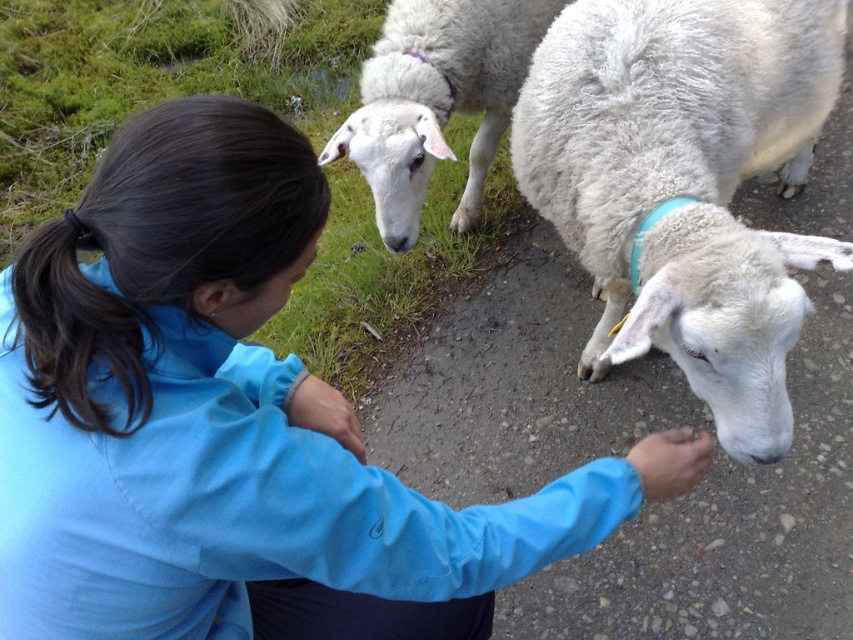
Is blue fabric jacket at center to the left of white woolen sheep at upper center from the viewer's perspective?

Correct, you'll find blue fabric jacket at center to the left of white woolen sheep at upper center.

Does point (13, 515) lie in front of point (354, 141)?

Yes, point (13, 515) is in front of point (354, 141).

Is point (0, 429) closer to viewer compared to point (469, 164)?

Yes, point (0, 429) is in front of point (469, 164).

The width and height of the screenshot is (853, 640). I want to click on blue fabric jacket at center, so click(231, 422).

Who is higher up, white woolen sheep at center or dark brown silky hair at upper left?

white woolen sheep at center is higher up.

How much distance is there between white woolen sheep at center and dark brown silky hair at upper left?

white woolen sheep at center is 3.70 feet from dark brown silky hair at upper left.

You are a GUI agent. You are given a task and a screenshot of the screen. Output one action in this format:
    pyautogui.click(x=<x>, y=<y>)
    Task: Click on the white woolen sheep at center
    The width and height of the screenshot is (853, 640).
    Given the screenshot: What is the action you would take?
    pyautogui.click(x=685, y=184)

At what (x,y) coordinates should I click in order to perform the action: click on white woolen sheep at center. Please return your answer as a coordinate pair (x, y). This screenshot has height=640, width=853. Looking at the image, I should click on (685, 184).

Which is behind, point (285, 148) or point (50, 308)?

The point (285, 148) is behind.

In the scene shown: Can you confirm if blue fabric jacket at center is bigger than dark brown silky hair at upper left?

Yes.

Is point (392, 506) closer to viewer compared to point (45, 246)?

No, it is not.

Identify the location of blue fabric jacket at center. (231, 422).